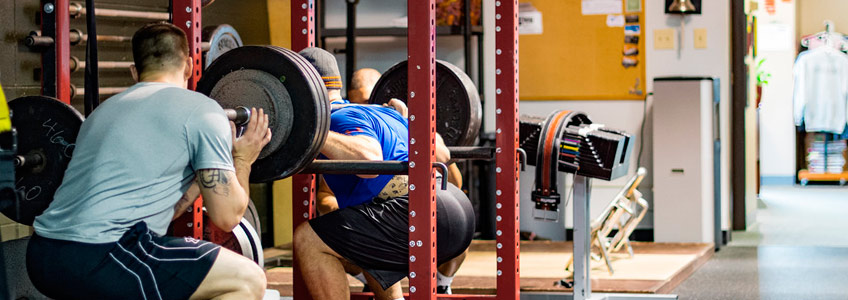
This screenshot has height=300, width=848. Identify the location of paper posted on board. point(631,4), point(631,19), point(631,31), point(632,39), point(631,51), point(629,60), point(612,21), point(605,6), point(534,27).